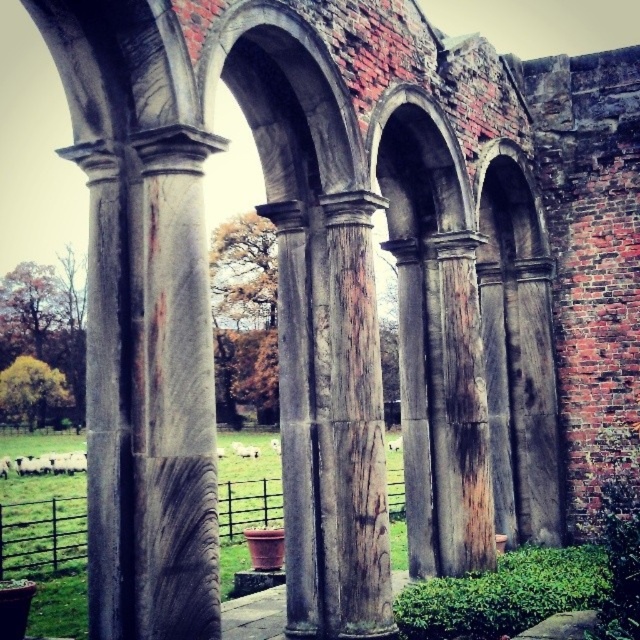
Describe the element at coordinates (173, 396) in the screenshot. I see `marble column at center` at that location.

Is marble column at center to the right of rusty metal archway at center from the viewer's perspective?

Incorrect, marble column at center is not on the right side of rusty metal archway at center.

Is point (152, 317) positioned before point (433, 474)?

Yes, it is in front of point (433, 474).

Identify the location of marble column at center. This screenshot has height=640, width=640. coord(173,396).